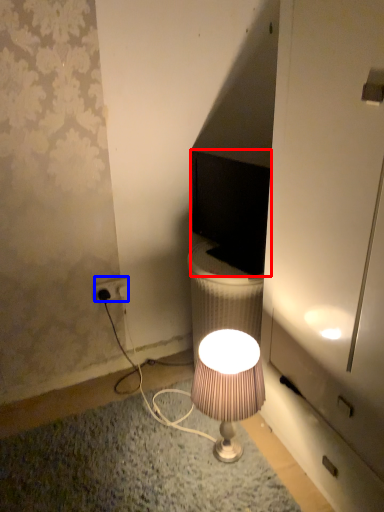
Question: Which point is further to the camera, computer monitor (highlighted by a red box) or power outlet (highlighted by a blue box)?

Choices:
 (A) computer monitor
 (B) power outlet

Answer: (B)